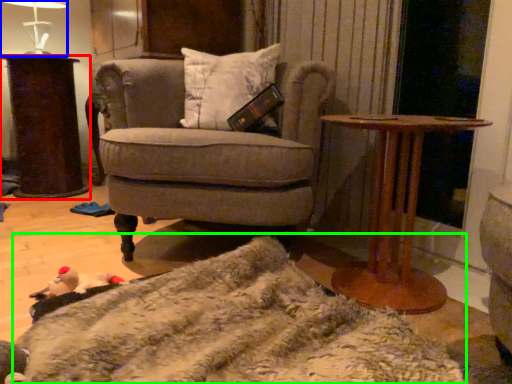
Question: Based on their relative distances, which object is farther from desk (highlighted by a red box)? Choose from table lamp (highlighted by a blue box) and blanket (highlighted by a green box).

Choices:
 (A) table lamp
 (B) blanket

Answer: (B)